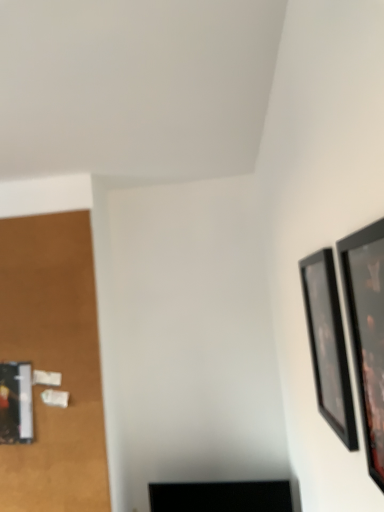
Question: Is black glossy picture frame at upper right, arranged as the 2th picture frame when viewed from the back, aimed at black glossy tv at lower center?

Choices:
 (A) yes
 (B) no

Answer: (B)

Question: Is black glossy picture frame at upper right, arranged as the 2th picture frame when viewed from the back, facing away from black glossy tv at lower center?

Choices:
 (A) no
 (B) yes

Answer: (A)

Question: Is black glossy picture frame at upper right, arranged as the 2th picture frame when viewed from the back, at the left side of black glossy tv at lower center?

Choices:
 (A) yes
 (B) no

Answer: (B)

Question: Is black glossy picture frame at upper right, which ranks as the first picture frame in front-to-back order, in front of black glossy tv at lower center?

Choices:
 (A) yes
 (B) no

Answer: (A)

Question: Is black glossy picture frame at upper right, which ranks as the first picture frame in front-to-back order, at the right side of black glossy tv at lower center?

Choices:
 (A) no
 (B) yes

Answer: (B)

Question: Relative to black glossy tv at lower center, is black glossy picture frame at upper right, which ranks as the first picture frame in front-to-back order, in front or behind?

Choices:
 (A) behind
 (B) front

Answer: (B)

Question: From a real-world perspective, is black glossy picture frame at upper right, which ranks as the first picture frame in front-to-back order, above or below black glossy tv at lower center?

Choices:
 (A) above
 (B) below

Answer: (A)

Question: Considering the positions of black glossy picture frame at upper right, which ranks as the first picture frame in front-to-back order, and black glossy tv at lower center in the image, is black glossy picture frame at upper right, which ranks as the first picture frame in front-to-back order, bigger or smaller than black glossy tv at lower center?

Choices:
 (A) small
 (B) big

Answer: (A)

Question: Is point (367, 335) closer or farther from the camera than point (218, 493)?

Choices:
 (A) closer
 (B) farther

Answer: (A)

Question: From a real-world perspective, is black glossy picture frame at right, which is the first picture frame from back to front, above or below black glossy picture frame at upper right, which ranks as the first picture frame in front-to-back order?

Choices:
 (A) below
 (B) above

Answer: (A)

Question: Considering their positions, is black glossy picture frame at right, which is the first picture frame from back to front, located in front of or behind black glossy picture frame at upper right, which ranks as the first picture frame in front-to-back order?

Choices:
 (A) behind
 (B) front

Answer: (A)

Question: Is point (336, 337) positioned closer to the camera than point (360, 287)?

Choices:
 (A) closer
 (B) farther

Answer: (B)

Question: Considering the positions of black glossy picture frame at right, which is the first picture frame from back to front, and black glossy picture frame at upper right, which ranks as the first picture frame in front-to-back order, in the image, is black glossy picture frame at right, which is the first picture frame from back to front, wider or thinner than black glossy picture frame at upper right, which ranks as the first picture frame in front-to-back order,?

Choices:
 (A) thin
 (B) wide

Answer: (A)

Question: Is black glossy picture frame at right, which is the first picture frame from back to front, to the left or to the right of black glossy tv at lower center in the image?

Choices:
 (A) left
 (B) right

Answer: (B)

Question: Looking at the image, does black glossy picture frame at right, the second picture frame positioned from the front, seem bigger or smaller compared to black glossy tv at lower center?

Choices:
 (A) big
 (B) small

Answer: (B)